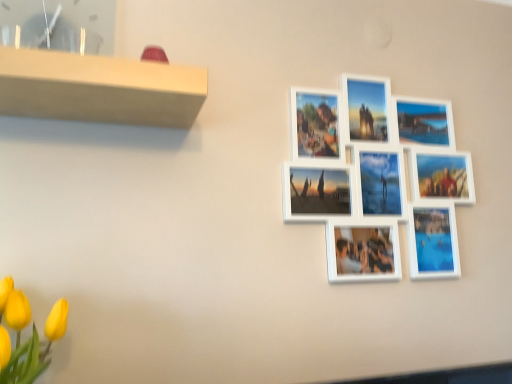
Question: Looking at the image, does white matte picture frame at upper right, positioned as the 1th picture frame in right-to-left order, seem bigger or smaller compared to matte white picture frame at upper left, acting as the 1th picture frame starting from the front?

Choices:
 (A) small
 (B) big

Answer: (B)

Question: Considering the positions of white matte picture frame at upper right, the 1th picture frame viewed from the back, and matte white picture frame at upper left, placed as the second picture frame when sorted from back to front, in the image, is white matte picture frame at upper right, the 1th picture frame viewed from the back, taller or shorter than matte white picture frame at upper left, placed as the second picture frame when sorted from back to front,?

Choices:
 (A) tall
 (B) short

Answer: (A)

Question: Is point (460, 195) positioned closer to the camera than point (33, 16)?

Choices:
 (A) closer
 (B) farther

Answer: (B)

Question: Considering the positions of matte white picture frame at upper left, placed as the second picture frame when sorted from back to front, and white matte picture frame at upper right, positioned as the 1th picture frame in right-to-left order, in the image, is matte white picture frame at upper left, placed as the second picture frame when sorted from back to front, bigger or smaller than white matte picture frame at upper right, positioned as the 1th picture frame in right-to-left order,?

Choices:
 (A) big
 (B) small

Answer: (B)

Question: In the image, is matte white picture frame at upper left, placed as the second picture frame when sorted from back to front, on the left side or the right side of white matte picture frame at upper right, positioned as the 1th picture frame in right-to-left order?

Choices:
 (A) left
 (B) right

Answer: (A)

Question: Is point (73, 43) closer or farther from the camera than point (379, 223)?

Choices:
 (A) closer
 (B) farther

Answer: (A)

Question: From a real-world perspective, is matte white picture frame at upper left, placed as the second picture frame when sorted from back to front, above or below white matte picture frame at upper right, marked as the 2th picture frame in a front-to-back arrangement?

Choices:
 (A) below
 (B) above

Answer: (B)